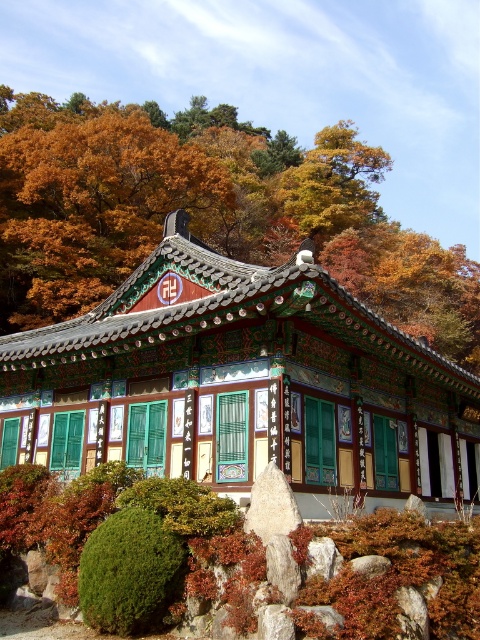
Between polished wood gazebo at center and autumn leaves at center, which one is positioned higher?

autumn leaves at center is higher up.

Is polished wood gazebo at center positioned before autumn leaves at center?

That is True.

Find the location of a particular element. This screenshot has height=640, width=480. polished wood gazebo at center is located at coordinates (242, 385).

Identify the location of polished wood gazebo at center. The height and width of the screenshot is (640, 480). (242, 385).

Measure the distance from autumn leaves at center to green fuzzy bush at lower left.

autumn leaves at center is 50.43 meters away from green fuzzy bush at lower left.

Does autumn leaves at center appear on the right side of green fuzzy bush at lower left?

Yes, autumn leaves at center is to the right of green fuzzy bush at lower left.

Locate an element on the screen. autumn leaves at center is located at coordinates (206, 211).

You are a GUI agent. You are given a task and a screenshot of the screen. Output one action in this format:
    pyautogui.click(x=<x>, y=<y>)
    Task: Click on the autumn leaves at center
    
    Given the screenshot: What is the action you would take?
    pyautogui.click(x=206, y=211)

Can you confirm if autumn leaves at center is positioned above autumn leaves at upper center?

Indeed, autumn leaves at center is positioned over autumn leaves at upper center.

Consider the image. Can you confirm if autumn leaves at center is wider than autumn leaves at upper center?

Indeed, autumn leaves at center has a greater width compared to autumn leaves at upper center.

Who is more distant from viewer, (86, 134) or (83, 147)?

The point (86, 134) is behind.

Locate an element on the screen. This screenshot has height=640, width=480. autumn leaves at center is located at coordinates (206, 211).